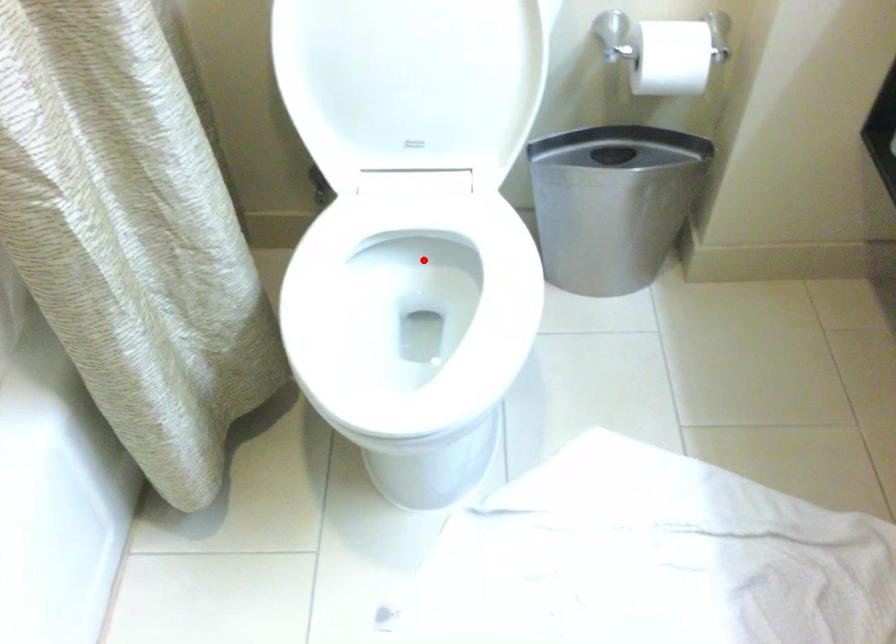
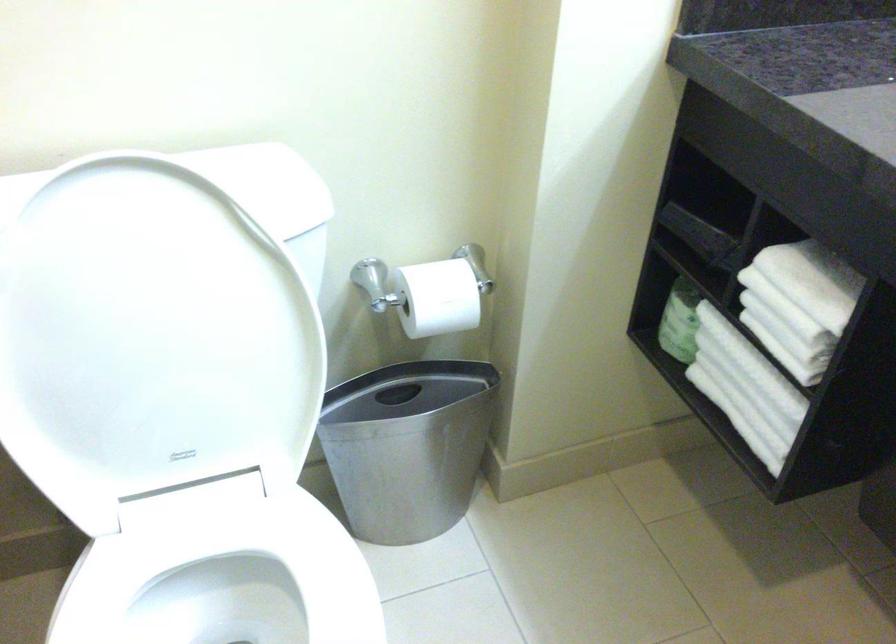
In the second image, find the point that corresponds to the highlighted location in the first image.

(225, 581)